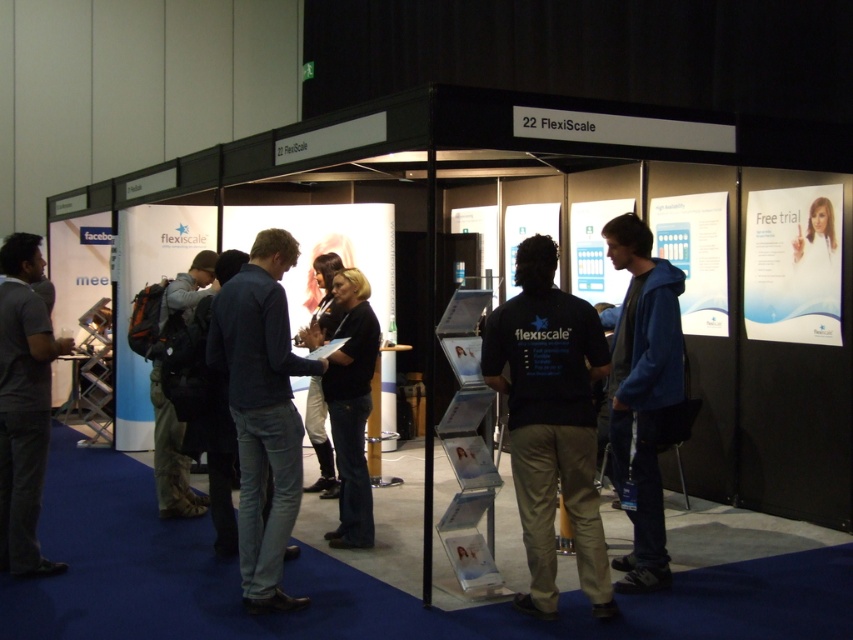
Question: Does dark gray shirt at left appear over black fabric at center?

Choices:
 (A) yes
 (B) no

Answer: (B)

Question: Does blue fleece jacket at right lie behind camouflage fabric backpack at left?

Choices:
 (A) yes
 (B) no

Answer: (B)

Question: Which point is closer to the camera?

Choices:
 (A) camouflage fabric backpack at left
 (B) dark gray shirt at left

Answer: (B)

Question: Can you confirm if dark gray shirt at left is positioned to the right of camouflage fabric backpack at left?

Choices:
 (A) no
 (B) yes

Answer: (A)

Question: Which point is farther to the camera?

Choices:
 (A) black cotton shirt at center
 (B) black matte shirt at center
 (C) camouflage fabric backpack at left

Answer: (C)

Question: Which object is farther from the camera taking this photo?

Choices:
 (A) dark gray shirt at left
 (B) camouflage fabric backpack at left
 (C) black cotton shirt at center

Answer: (B)